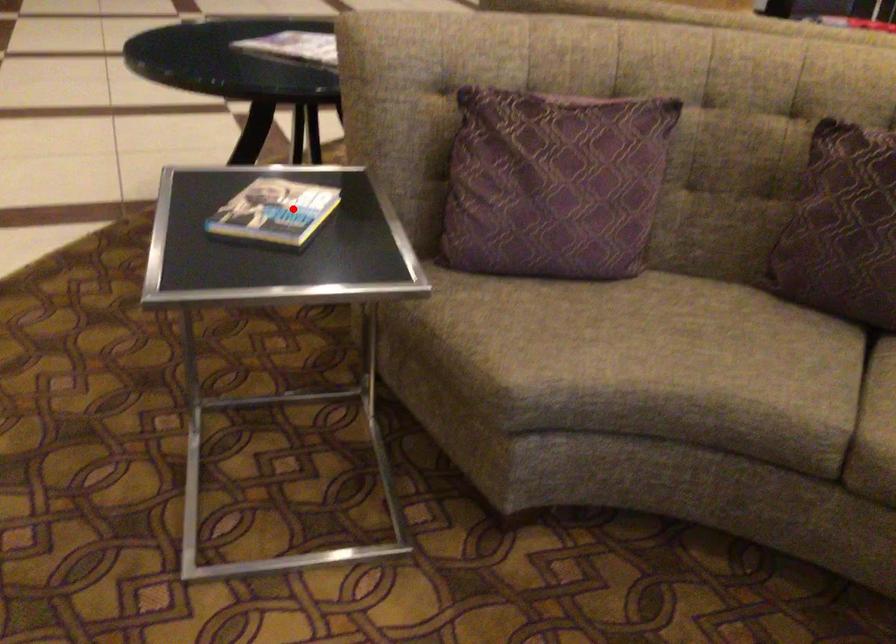
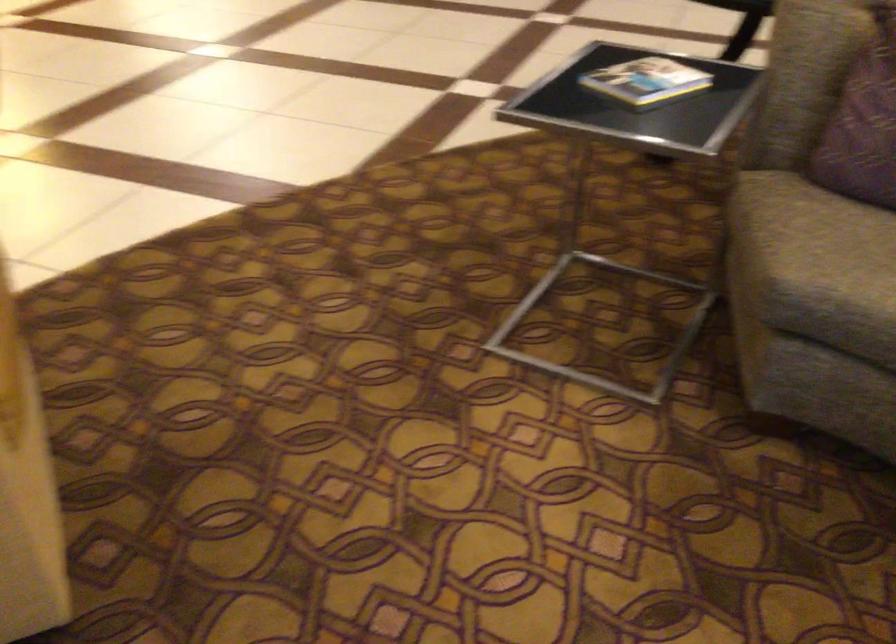
Where in the second image is the point corresponding to the highlighted location from the first image?

(645, 80)